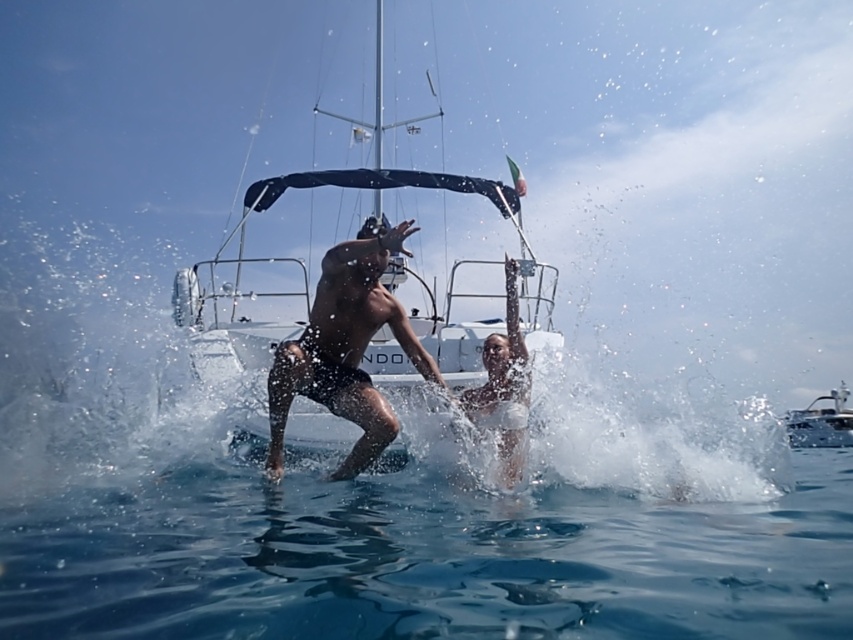
Is brown matte skin at center to the right of white matte bikini at center from the viewer's perspective?

In fact, brown matte skin at center is to the left of white matte bikini at center.

At what (x,y) coordinates should I click in order to perform the action: click on brown matte skin at center. Please return your answer as a coordinate pair (x, y). The height and width of the screenshot is (640, 853). Looking at the image, I should click on (345, 348).

You are a GUI agent. You are given a task and a screenshot of the screen. Output one action in this format:
    pyautogui.click(x=<x>, y=<y>)
    Task: Click on the brown matte skin at center
    
    Given the screenshot: What is the action you would take?
    click(345, 348)

Can you confirm if white matte boat at center is thinner than brown matte skin at center?

Indeed, white matte boat at center has a lesser width compared to brown matte skin at center.

Who is more distant from viewer, (x=546, y=305) or (x=305, y=337)?

Positioned behind is point (x=546, y=305).

Between point (252, 433) and point (404, 332), which one is positioned behind?

Point (404, 332)

This screenshot has height=640, width=853. Identify the location of white matte boat at center. (376, 323).

Between white matte boat at center and white matte bikini at center, which one is positioned higher?

white matte bikini at center is higher up.

Does white matte boat at center appear over white matte bikini at center?

No.

Does point (352, 342) lie behind point (527, 387)?

Yes, point (352, 342) is behind point (527, 387).

The width and height of the screenshot is (853, 640). What are the coordinates of `white matte boat at center` in the screenshot? It's located at (376, 323).